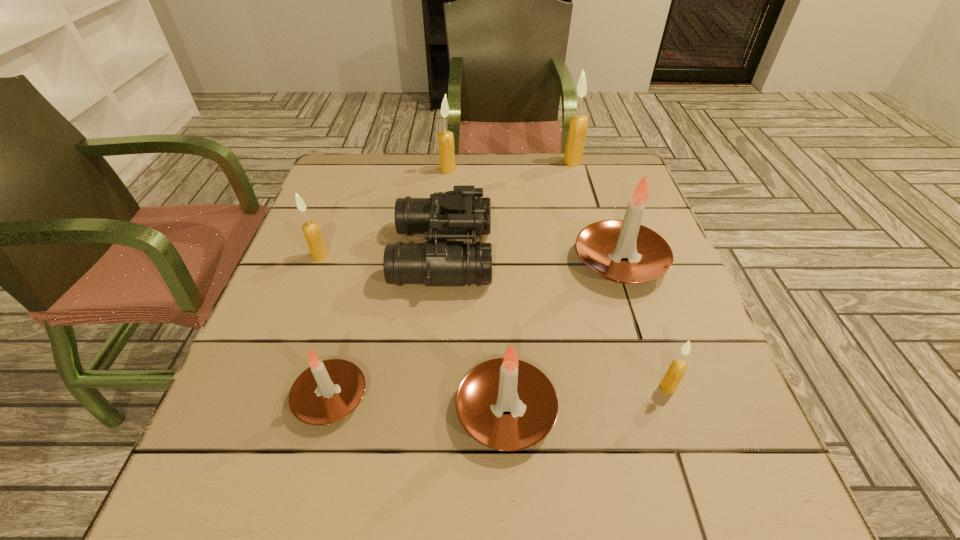
Find the location of a particular element. The image size is (960, 540). the sixth closest object relative to the rightmost cream candle is located at coordinates (311, 231).

The height and width of the screenshot is (540, 960). I want to click on object that is the sixth closest to the binoculars, so click(x=578, y=124).

Where is `candle that is the third closest to the second candle from left to right`? Image resolution: width=960 pixels, height=540 pixels. candle that is the third closest to the second candle from left to right is located at coordinates (601, 245).

Identify which candle is located as the fifth nearest to the leftmost white candle. Please provide its 2D coordinates. Your answer should be formatted as a tuple, i.e. [(x, y)], where the tuple contains the x and y coordinates of a point satisfying the conditions above.

[(445, 138)]

Identify the location of cream candle that can be found as the second closest to the rightmost cream candle. (311, 231).

Choose which cream candle is the third nearest neighbor to the leftmost white candle. Please provide its 2D coordinates. Your answer should be formatted as a tuple, i.e. [(x, y)], where the tuple contains the x and y coordinates of a point satisfying the conditions above.

[(445, 138)]

Find the location of `white candle that is the closest one to the farthest white candle`. white candle that is the closest one to the farthest white candle is located at coordinates (504, 384).

Find the location of a particular element. white candle that stands as the closest to the fifth candle from right to left is located at coordinates (601, 245).

Identify the location of free space that satisfies the following two spatial constraints: 1. through the lenses of the fourth candle from left to right; 2. on the left side of the blue binoculars. The image size is (960, 540). (x=429, y=410).

Find the location of a particular element. The width and height of the screenshot is (960, 540). free location that satisfies the following two spatial constraints: 1. through the lenses of the second white candle from left to right; 2. on the right side of the blue binoculars is located at coordinates (429, 410).